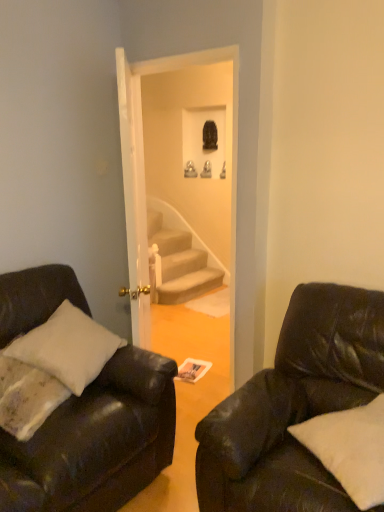
Question: Is the depth of black leather couch at right, acting as the 2th studio couch starting from the left, greater than that of matte black couch at left, the 2th studio couch when ordered from right to left?

Choices:
 (A) no
 (B) yes

Answer: (A)

Question: Can you confirm if black leather couch at right, the first studio couch from the right, is positioned to the right of matte black couch at left, the 1th studio couch from the left?

Choices:
 (A) no
 (B) yes

Answer: (B)

Question: Is matte black couch at left, the 1th studio couch from the left, surrounded by black leather couch at right, acting as the 2th studio couch starting from the left?

Choices:
 (A) no
 (B) yes

Answer: (A)

Question: Considering the relative sizes of black leather couch at right, the first studio couch from the right, and matte black couch at left, the 2th studio couch when ordered from right to left, in the image provided, is black leather couch at right, the first studio couch from the right, shorter than matte black couch at left, the 2th studio couch when ordered from right to left,?

Choices:
 (A) no
 (B) yes

Answer: (B)

Question: From a real-world perspective, is black leather couch at right, the first studio couch from the right, located higher than matte black couch at left, the 2th studio couch when ordered from right to left?

Choices:
 (A) no
 (B) yes

Answer: (A)

Question: Is black leather couch at right, acting as the 2th studio couch starting from the left, completely or partially outside of matte black couch at left, the 1th studio couch from the left?

Choices:
 (A) yes
 (B) no

Answer: (A)

Question: Is black leather couch at right, acting as the 2th studio couch starting from the left, smaller than white soft pillow at lower right?

Choices:
 (A) yes
 (B) no

Answer: (B)

Question: Is black leather couch at right, acting as the 2th studio couch starting from the left, at the left side of white soft pillow at lower right?

Choices:
 (A) no
 (B) yes

Answer: (B)

Question: Considering the relative sizes of black leather couch at right, the first studio couch from the right, and white soft pillow at lower right in the image provided, is black leather couch at right, the first studio couch from the right, thinner than white soft pillow at lower right?

Choices:
 (A) no
 (B) yes

Answer: (A)

Question: From the image's perspective, would you say black leather couch at right, the first studio couch from the right, is shown under white soft pillow at lower right?

Choices:
 (A) yes
 (B) no

Answer: (A)

Question: Is black leather couch at right, the first studio couch from the right, further to the viewer compared to white soft pillow at lower right?

Choices:
 (A) yes
 (B) no

Answer: (B)

Question: Can you confirm if black leather couch at right, acting as the 2th studio couch starting from the left, is wider than white soft pillow at lower right?

Choices:
 (A) no
 (B) yes

Answer: (B)

Question: Is the position of matte black couch at left, the 1th studio couch from the left, less distant than that of black leather couch at right, acting as the 2th studio couch starting from the left?

Choices:
 (A) no
 (B) yes

Answer: (A)